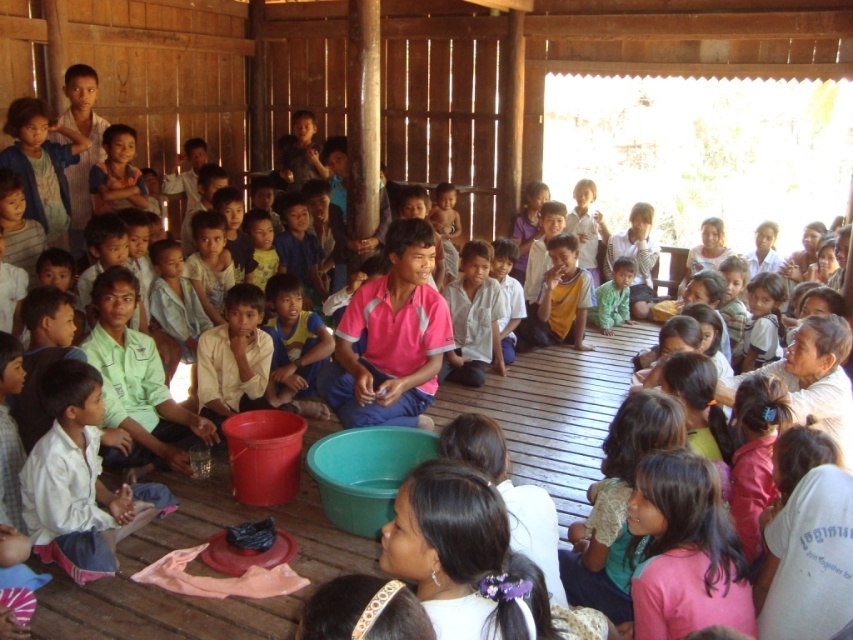
Question: Is pink fabric shirt at center above white matte shirt at upper right?

Choices:
 (A) no
 (B) yes

Answer: (B)

Question: Can you confirm if white matte shirt at upper right is thinner than white cotton shirt at center?

Choices:
 (A) yes
 (B) no

Answer: (B)

Question: Does pink fabric shirt at center appear over green matte shirt at center?

Choices:
 (A) no
 (B) yes

Answer: (A)

Question: Which is farther from the green matte shirt at center?

Choices:
 (A) pink fabric shirt at center
 (B) white cotton shirt at center
 (C) white matte shirt at upper right

Answer: (A)

Question: Which object is closer to the camera taking this photo?

Choices:
 (A) pink fabric shirt at center
 (B) green matte shirt at center

Answer: (A)

Question: Which point is closer to the camera taking this photo?

Choices:
 (A) (469, 273)
 (B) (405, 234)
 (C) (608, 294)

Answer: (B)